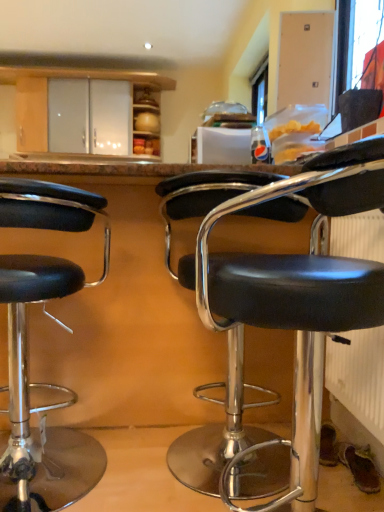
Question: Considering the positions of black leather stool at left, which is the 1th chair in left-to-right order, and white textured radiator at lower right in the image, is black leather stool at left, which is the 1th chair in left-to-right order, bigger or smaller than white textured radiator at lower right?

Choices:
 (A) small
 (B) big

Answer: (B)

Question: Do you think black leather stool at left, which is the 1th chair in left-to-right order, is within white textured radiator at lower right, or outside of it?

Choices:
 (A) inside
 (B) outside

Answer: (B)

Question: Considering the real-world distances, which object is closest to the black leather stool at left, arranged as the 2th chair when viewed from the right?

Choices:
 (A) black leather stool at center, the 1th chair viewed from the right
 (B) white textured radiator at lower right

Answer: (A)

Question: Which of these objects is positioned closest to the black leather stool at left, arranged as the 2th chair when viewed from the right?

Choices:
 (A) black leather stool at center, placed as the 2th chair when sorted from left to right
 (B) white textured radiator at lower right

Answer: (A)